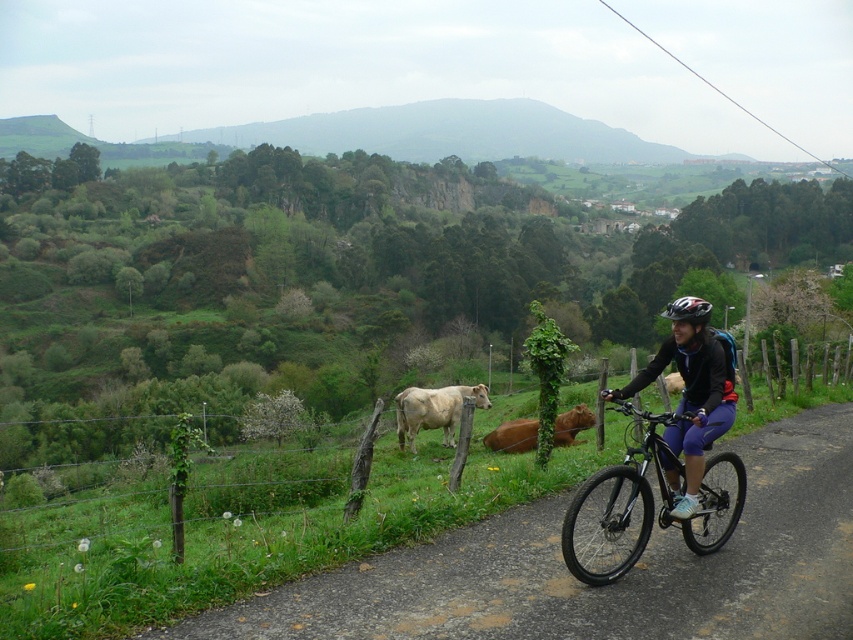
You are standing at the starting point of the paved road in the image. You want to walk straight ahead along the road. Will you encounter the green wooden fence at lower center before reaching the first curve of the road?

The green wooden fence at lower center is positioned at point (264, 502), which is before the first curve of the road. Therefore, you will encounter the green wooden fence at lower center before reaching the first curve of the road.

You are standing at the starting point of the paved road and want to reach the matte black bicycle at center. The green wooden fence at lower center is in your way. Can you walk around it on either side?

The green wooden fence at lower center is 21.55 meters away from matte black bicycle at center. Since the fence is along the road, you can walk around it by following the paved road which curves to the right, allowing you to bypass the fence and reach the matte black bicycle at center.